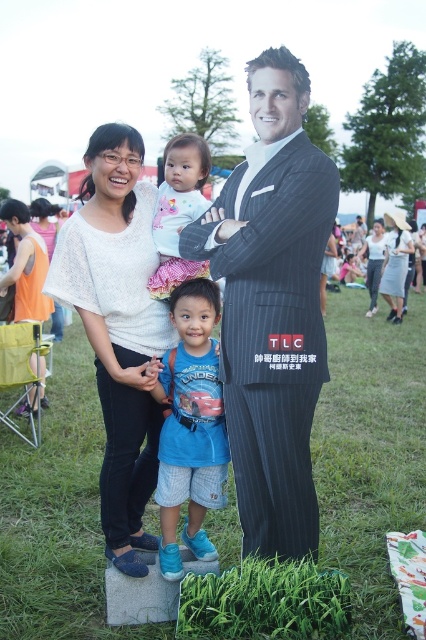
Looking at this image, does white knitwear at center appear on the left side of white cotton shirt at center?

Correct, you'll find white knitwear at center to the left of white cotton shirt at center.

Does white knitwear at center have a lesser height compared to white cotton shirt at center?

Indeed, white knitwear at center has a lesser height compared to white cotton shirt at center.

Identify the location of white knitwear at center. The height and width of the screenshot is (640, 426). (118, 326).

The width and height of the screenshot is (426, 640). I want to click on white knitwear at center, so click(x=118, y=326).

In the scene shown: Can you confirm if striped suit at center is thinner than white cotton onesie at center?

No, striped suit at center is not thinner than white cotton onesie at center.

Is striped suit at center smaller than white cotton onesie at center?

Actually, striped suit at center might be larger than white cotton onesie at center.

This screenshot has width=426, height=640. Describe the element at coordinates (271, 307) in the screenshot. I see `striped suit at center` at that location.

Image resolution: width=426 pixels, height=640 pixels. Identify the location of striped suit at center. (271, 307).

Which of these two, white cotton onesie at center or white cotton shirt at center, stands taller?

white cotton shirt at center is taller.

Between point (161, 230) and point (371, 260), which one is positioned in front?

Point (161, 230) is more forward.

Which is in front, point (169, 257) or point (376, 244)?

Point (169, 257) is more forward.

Locate an element on the screen. This screenshot has height=640, width=426. white cotton onesie at center is located at coordinates (178, 211).